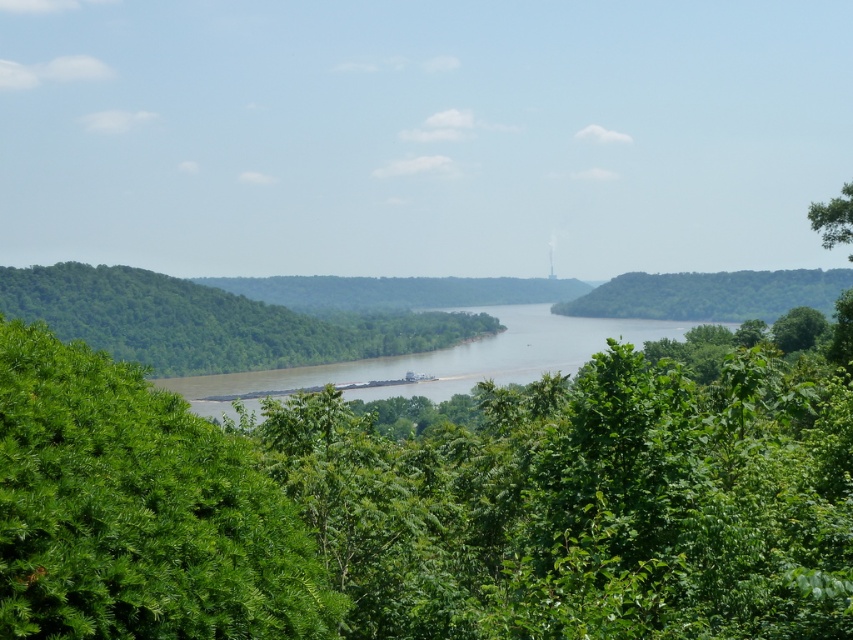
Which of these two, green leafy tree at left or green leafy tree at right, stands taller?

green leafy tree at left is taller.

Between point (113, 268) and point (779, 330), which one is positioned in front?

Positioned in front is point (779, 330).

I want to click on green leafy tree at left, so click(x=212, y=321).

Measure the distance from green leafy tree at center to brown/muddy water at center.

green leafy tree at center is 36.36 meters away from brown/muddy water at center.

Is green leafy tree at center above brown/muddy water at center?

Indeed, green leafy tree at center is positioned over brown/muddy water at center.

Which is behind, point (48, 570) or point (535, 365)?

The point (535, 365) is behind.

Where is `green leafy tree at center`? The height and width of the screenshot is (640, 853). green leafy tree at center is located at coordinates (138, 509).

Is green leafy tree at center below green leafy tree at right?

Indeed, green leafy tree at center is positioned under green leafy tree at right.

Where is `green leafy tree at center`? Image resolution: width=853 pixels, height=640 pixels. green leafy tree at center is located at coordinates (138, 509).

You are a GUI agent. You are given a task and a screenshot of the screen. Output one action in this format:
    pyautogui.click(x=<x>, y=<y>)
    Task: Click on the green leafy tree at center
    Image resolution: width=853 pixels, height=640 pixels.
    Given the screenshot: What is the action you would take?
    pyautogui.click(x=138, y=509)